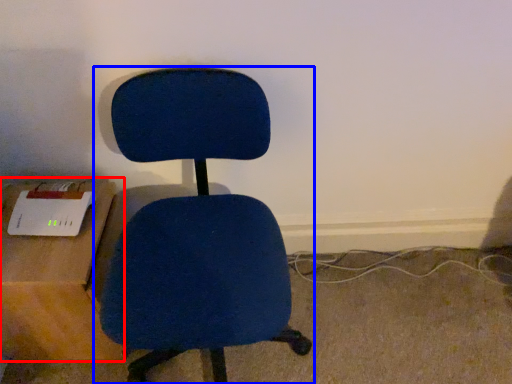
Question: Which object is further to the camera taking this photo, table (highlighted by a red box) or chair (highlighted by a blue box)?

Choices:
 (A) table
 (B) chair

Answer: (A)